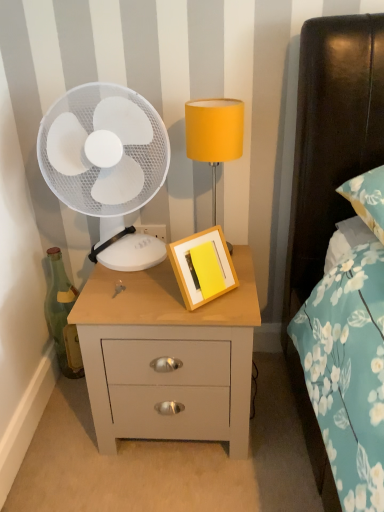
At what (x,y) coordinates should I click in order to perform the action: click on free space above light wood/finish nightstand at center (from a real-world perspective). Please return your answer as a coordinate pair (x, y). This screenshot has height=512, width=384. Looking at the image, I should click on (154, 286).